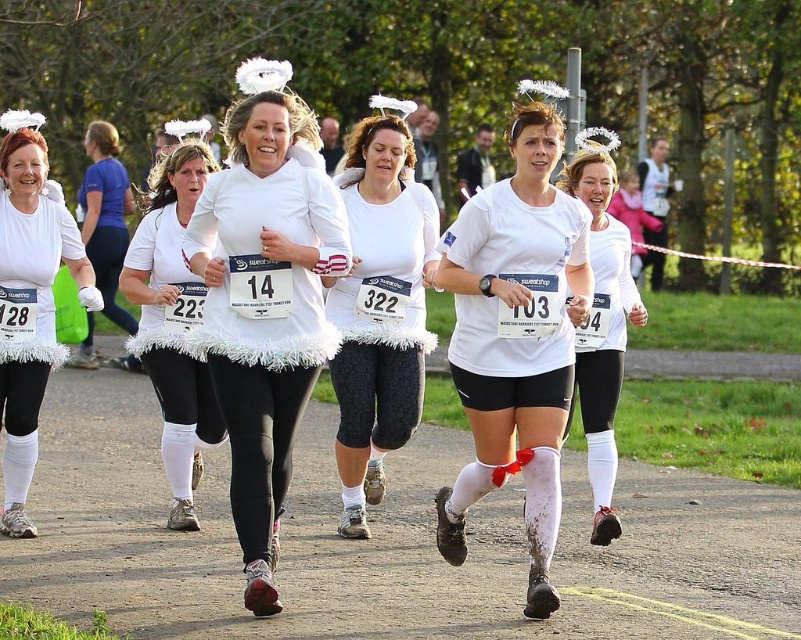
Between white fabric leggings at center and white fluffy skirt at left, which one appears on the right side from the viewer's perspective?

Positioned to the right is white fabric leggings at center.

Can you confirm if white fabric leggings at center is taller than white fluffy skirt at left?

No, white fabric leggings at center is not taller than white fluffy skirt at left.

Is point (767, 522) positioned in front of point (2, 179)?

No, it is not.

Image resolution: width=801 pixels, height=640 pixels. I want to click on white fabric leggings at center, so click(x=385, y=544).

Can you confirm if white matte t-shirt at center is positioned above white textured fabric at center?

Incorrect, white matte t-shirt at center is not positioned above white textured fabric at center.

The width and height of the screenshot is (801, 640). What do you see at coordinates (516, 339) in the screenshot? I see `white matte t-shirt at center` at bounding box center [516, 339].

The image size is (801, 640). I want to click on white matte t-shirt at center, so click(516, 339).

Does white fluffy dress at center appear under white textured fabric at center?

Indeed, white fluffy dress at center is positioned under white textured fabric at center.

In the scene shown: Can you confirm if white fluffy dress at center is positioned above white textured fabric at center?

No.

This screenshot has width=801, height=640. In order to click on white fluffy dress at center in this screenshot , I will do `click(264, 305)`.

Find the location of a particular element. Image resolution: width=801 pixels, height=640 pixels. white fluffy dress at center is located at coordinates (264, 305).